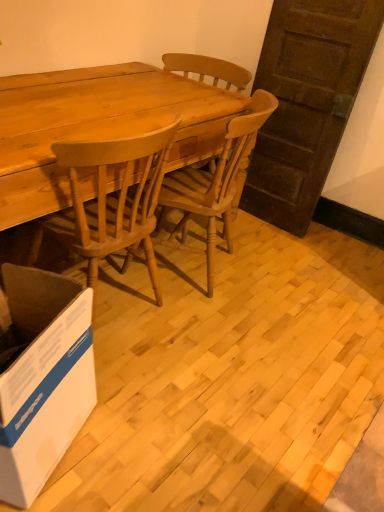
The height and width of the screenshot is (512, 384). What do you see at coordinates (44, 379) in the screenshot?
I see `white cardboard box at lower left` at bounding box center [44, 379].

Locate an element on the screen. The height and width of the screenshot is (512, 384). light brown wood desk at center is located at coordinates (97, 125).

How different are the orientations of white cardboard box at lower left and light brown wood chair at center in degrees?

They differ by 178 degrees in their facing directions.

Between white cardboard box at lower left and light brown wood chair at center, which one has larger size?

With larger size is light brown wood chair at center.

Find the location of a particular element. The height and width of the screenshot is (512, 384). box that appears below the light brown wood chair at center (from the image's perspective) is located at coordinates (44, 379).

From the image's perspective, is white cardboard box at lower left on light brown wood chair at center?

Incorrect, from the image's perspective, white cardboard box at lower left is lower than light brown wood chair at center.

From the image's perspective, is light brown wood chair at center above white cardboard box at lower left?

Yes, from the image's perspective, light brown wood chair at center is over white cardboard box at lower left.

Is light brown wood chair at center wider or thinner than white cardboard box at lower left?

light brown wood chair at center is wider than white cardboard box at lower left.

From a real-world perspective, between light brown wood chair at center and white cardboard box at lower left, who is vertically lower?

white cardboard box at lower left is physically lower.

Would you say light brown wood chair at center is outside white cardboard box at lower left?

Yes, light brown wood chair at center is outside of white cardboard box at lower left.

Is white cardboard box at lower left wider or thinner than light brown wood desk at center?

Clearly, white cardboard box at lower left has less width compared to light brown wood desk at center.

Does point (33, 485) lie in front of point (20, 199)?

Yes, point (33, 485) is in front of point (20, 199).

Who is smaller, white cardboard box at lower left or light brown wood desk at center?

white cardboard box at lower left.

From the image's perspective, is white cardboard box at lower left located beneath light brown wood desk at center?

Yes.

Is light brown wood desk at center looking in the opposite direction of white cardboard box at lower left?

No, light brown wood desk at center is not facing away from white cardboard box at lower left.

Would you say light brown wood desk at center contains white cardboard box at lower left?

That's incorrect, white cardboard box at lower left is not inside light brown wood desk at center.

From the picture: Relative to white cardboard box at lower left, is light brown wood desk at center in front or behind?

Visually, light brown wood desk at center is located behind white cardboard box at lower left.

Which of these two, light brown wood desk at center or light brown wood chair at center, is thinner?

Thinner between the two is light brown wood chair at center.

Does light brown wood desk at center have a greater height compared to light brown wood chair at center?

In fact, light brown wood desk at center may be shorter than light brown wood chair at center.

What are the coordinates of `chair on the right of light brown wood desk at center` in the screenshot? It's located at (215, 180).

What's the angular difference between light brown wood desk at center and light brown wood chair at center's facing directions?

The angle between the facing direction of light brown wood desk at center and the facing direction of light brown wood chair at center is 157 degrees.

From a real-world perspective, is light brown wood chair at center physically located above or below light brown wood desk at center?

From a real-world perspective, light brown wood chair at center is physically above light brown wood desk at center.

Is light brown wood chair at center situated inside light brown wood desk at center or outside?

light brown wood chair at center is spatially positioned inside light brown wood desk at center.

Does point (210, 237) come behind point (15, 115)?

That is True.

Between light brown wood chair at center and light brown wood desk at center, which one appears on the right side from the viewer's perspective?

Positioned to the right is light brown wood chair at center.

Locate an element on the screen. The height and width of the screenshot is (512, 384). chair lying on the right of white cardboard box at lower left is located at coordinates (215, 180).

The height and width of the screenshot is (512, 384). What are the coordinates of `box below the light brown wood chair at center (from the image's perspective)` in the screenshot? It's located at click(x=44, y=379).

Which object lies further to the anchor point white cardboard box at lower left, light brown wood desk at center or light brown wood chair at center?

Among the two, light brown wood chair at center is located further to white cardboard box at lower left.

Considering their positions, is light brown wood desk at center positioned further to light brown wood chair at center than white cardboard box at lower left?

white cardboard box at lower left lies further to light brown wood chair at center than the other object.

Estimate the real-world distances between objects in this image. Which object is closer to white cardboard box at lower left, light brown wood chair at center or light brown wood desk at center?

Based on the image, light brown wood desk at center appears to be nearer to white cardboard box at lower left.

Which object lies nearer to the anchor point light brown wood desk at center, light brown wood chair at center or white cardboard box at lower left?

light brown wood chair at center is closer to light brown wood desk at center.

Which object lies further to the anchor point light brown wood chair at center, white cardboard box at lower left or light brown wood desk at center?

white cardboard box at lower left.

Looking at the image, which one is located closer to light brown wood desk at center, white cardboard box at lower left or light brown wood chair at center?

light brown wood chair at center is positioned closer to the anchor light brown wood desk at center.

Identify the location of chair between light brown wood desk at center and white cardboard box at lower left vertically. The image size is (384, 512). (215, 180).